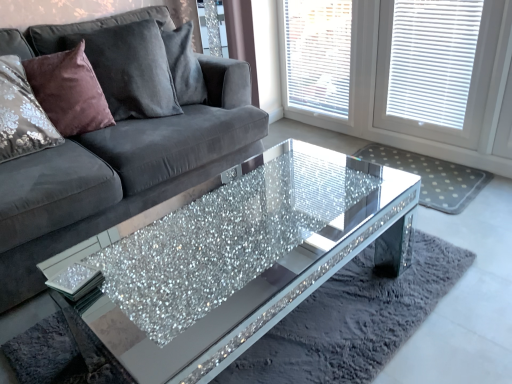
Question: Is white textured blinds at upper right to the left of white dotted mat at center from the viewer's perspective?

Choices:
 (A) yes
 (B) no

Answer: (B)

Question: Is white textured blinds at upper right aimed at white dotted mat at center?

Choices:
 (A) yes
 (B) no

Answer: (B)

Question: From a real-world perspective, is white textured blinds at upper right positioned under white dotted mat at center based on gravity?

Choices:
 (A) no
 (B) yes

Answer: (A)

Question: Would you say white textured blinds at upper right is outside white dotted mat at center?

Choices:
 (A) no
 (B) yes

Answer: (B)

Question: Is white textured blinds at upper right closer to camera compared to white dotted mat at center?

Choices:
 (A) yes
 (B) no

Answer: (A)

Question: From the image's perspective, is white textured blind at upper right positioned above or below velvet/maroon pillow at left, the 2th pillow viewed from the left?

Choices:
 (A) below
 (B) above

Answer: (B)

Question: From a real-world perspective, is white textured blind at upper right above or below velvet/maroon pillow at left, which is the 1th pillow in right-to-left order?

Choices:
 (A) above
 (B) below

Answer: (B)

Question: Considering the positions of white textured blind at upper right and velvet/maroon pillow at left, which is the 1th pillow in right-to-left order, in the image, is white textured blind at upper right wider or thinner than velvet/maroon pillow at left, which is the 1th pillow in right-to-left order,?

Choices:
 (A) thin
 (B) wide

Answer: (A)

Question: In terms of size, does white textured blind at upper right appear bigger or smaller than velvet/maroon pillow at left, the 2th pillow viewed from the left?

Choices:
 (A) small
 (B) big

Answer: (A)

Question: Is velvet/maroon pillow at left, which is the 1th pillow in right-to-left order, to the left or to the right of white textured blind at upper right in the image?

Choices:
 (A) right
 (B) left

Answer: (B)

Question: In the image, is velvet/maroon pillow at left, which is the 1th pillow in right-to-left order, positioned in front of or behind white textured blind at upper right?

Choices:
 (A) front
 (B) behind

Answer: (A)

Question: From a real-world perspective, is velvet/maroon pillow at left, the 2th pillow viewed from the left, positioned above or below white textured blind at upper right?

Choices:
 (A) above
 (B) below

Answer: (A)

Question: From the image's perspective, is velvet/maroon pillow at left, which is the 1th pillow in right-to-left order, located above or below white textured blind at upper right?

Choices:
 (A) above
 (B) below

Answer: (B)

Question: From a real-world perspective, relative to white textured blinds at upper right, is velvet grey couch at center vertically above or below?

Choices:
 (A) below
 (B) above

Answer: (A)

Question: Would you say velvet grey couch at center is to the left or to the right of white textured blinds at upper right in the picture?

Choices:
 (A) left
 (B) right

Answer: (A)